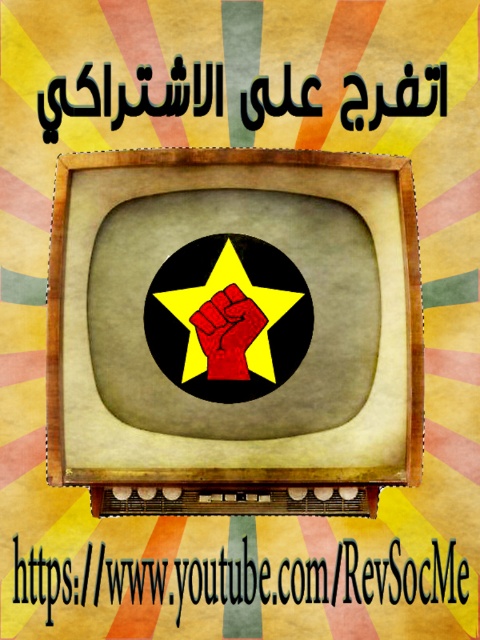
You are standing in front of the vintage television set. There are two points marked on the screen at coordinates point (265,314) and point (230,365). Which point is closer to you?

Point (265,314) is further to the viewer than point (230,365), so the point closer to you is point (230,365).

You are designing a digital poster and need to place a red circle around the yellow matte star at center. According to the image, where should you position the red circle to ensure it accurately surrounds the star?

The yellow matte star at center is located at point [210,298], so you should position the red circle at those coordinates to accurately surround it.